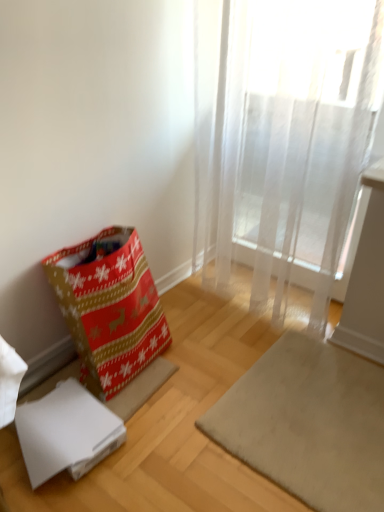
Question: Is white cardboard box at lower left oriented away from translucent white curtain at upper right?

Choices:
 (A) yes
 (B) no

Answer: (B)

Question: Considering the relative positions of white cardboard box at lower left and translucent white curtain at upper right in the image provided, is white cardboard box at lower left to the left of translucent white curtain at upper right from the viewer's perspective?

Choices:
 (A) no
 (B) yes

Answer: (B)

Question: From the image's perspective, is white cardboard box at lower left beneath translucent white curtain at upper right?

Choices:
 (A) yes
 (B) no

Answer: (A)

Question: Is white cardboard box at lower left outside of translucent white curtain at upper right?

Choices:
 (A) yes
 (B) no

Answer: (A)

Question: Is white cardboard box at lower left to the right of translucent white curtain at upper right from the viewer's perspective?

Choices:
 (A) no
 (B) yes

Answer: (A)

Question: Is christmas-patterned fabric gift bag at lower left wider or thinner than translucent white curtain at upper right?

Choices:
 (A) thin
 (B) wide

Answer: (B)

Question: Choose the correct answer: Is christmas-patterned fabric gift bag at lower left inside translucent white curtain at upper right or outside it?

Choices:
 (A) outside
 (B) inside

Answer: (A)

Question: Considering their positions, is christmas-patterned fabric gift bag at lower left located in front of or behind translucent white curtain at upper right?

Choices:
 (A) behind
 (B) front

Answer: (A)

Question: From a real-world perspective, is christmas-patterned fabric gift bag at lower left positioned above or below translucent white curtain at upper right?

Choices:
 (A) below
 (B) above

Answer: (A)

Question: Would you say christmas-patterned fabric gift bag at lower left is to the left or to the right of white cardboard box at lower left in the picture?

Choices:
 (A) right
 (B) left

Answer: (A)

Question: Is christmas-patterned fabric gift bag at lower left in front of or behind white cardboard box at lower left in the image?

Choices:
 (A) behind
 (B) front

Answer: (B)

Question: From a real-world perspective, is christmas-patterned fabric gift bag at lower left positioned above or below white cardboard box at lower left?

Choices:
 (A) below
 (B) above

Answer: (B)

Question: Considering the positions of christmas-patterned fabric gift bag at lower left and white cardboard box at lower left in the image, is christmas-patterned fabric gift bag at lower left wider or thinner than white cardboard box at lower left?

Choices:
 (A) thin
 (B) wide

Answer: (B)

Question: From the image's perspective, relative to christmas-patterned fabric gift bag at lower left, is translucent white curtain at upper right above or below?

Choices:
 (A) above
 (B) below

Answer: (A)

Question: Considering the positions of translucent white curtain at upper right and christmas-patterned fabric gift bag at lower left in the image, is translucent white curtain at upper right wider or thinner than christmas-patterned fabric gift bag at lower left?

Choices:
 (A) thin
 (B) wide

Answer: (A)